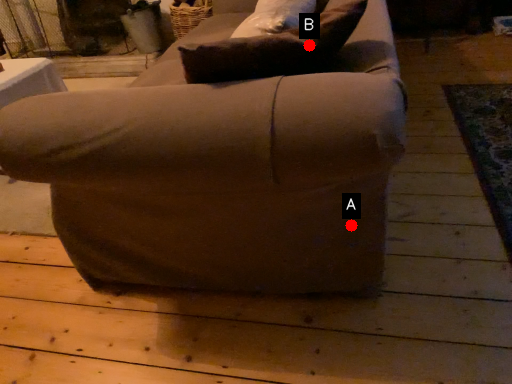
Question: Two points are circled on the image, labeled by A and B beside each circle. Which point is farther from the camera taking this photo?

Choices:
 (A) A is further
 (B) B is further

Answer: (A)